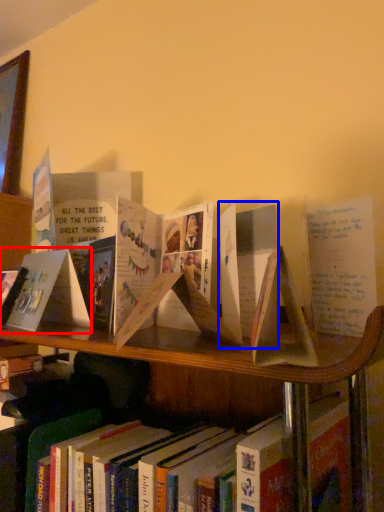
Question: Which object is closer to the camera taking this photo, paperback book (highlighted by a red box) or paperback book (highlighted by a blue box)?

Choices:
 (A) paperback book
 (B) paperback book

Answer: (B)